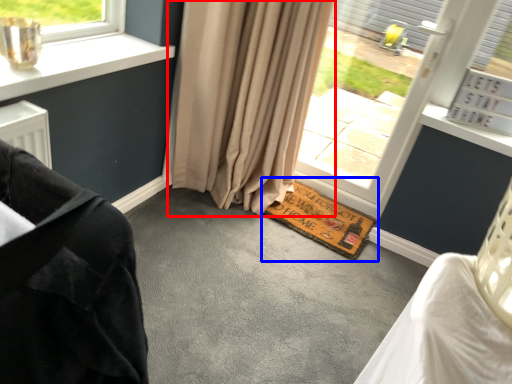
Question: Among these objects, which one is farthest to the camera, curtain (highlighted by a red box) or doormat (highlighted by a blue box)?

Choices:
 (A) curtain
 (B) doormat

Answer: (B)